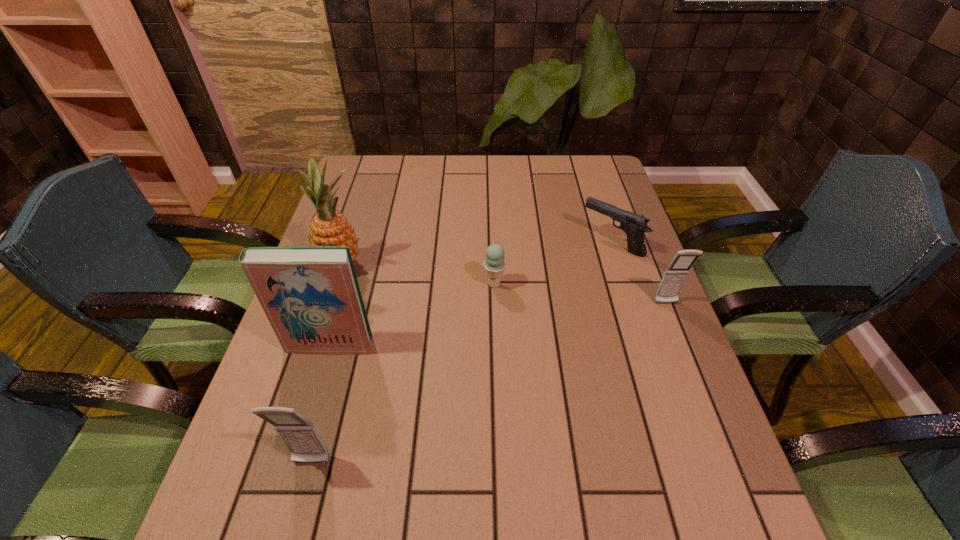
The height and width of the screenshot is (540, 960). I want to click on vacant point located 0.290m on the front of the fourth object from left to right, so click(497, 394).

At what (x,y) coordinates should I click in order to perform the action: click on free space located 0.290m at the muzzle of the gun. Please return your answer as a coordinate pair (x, y). The image size is (960, 540). Looking at the image, I should click on (481, 243).

Where is `free location located at the muzzle of the gun`? The height and width of the screenshot is (540, 960). free location located at the muzzle of the gun is located at coordinates pyautogui.click(x=564, y=243).

Locate an element on the screen. The image size is (960, 540). vacant region located at the muzzle of the gun is located at coordinates (495, 243).

Locate an element on the screen. This screenshot has height=540, width=960. free location located on the back of the pineapple is located at coordinates (372, 176).

This screenshot has width=960, height=540. I want to click on vacant space located 0.050m on the cover of the hardback book, so click(320, 374).

Where is `object present at the near edge`? object present at the near edge is located at coordinates (300, 435).

Identify the location of cellular telephone positioned at the left edge. (300, 435).

At what (x,y) coordinates should I click in order to perform the action: click on pineapple positioned at the left edge. Please return your answer as a coordinate pair (x, y). Image resolution: width=960 pixels, height=540 pixels. Looking at the image, I should click on (328, 227).

Where is `hardback book at the left edge`? hardback book at the left edge is located at coordinates (310, 294).